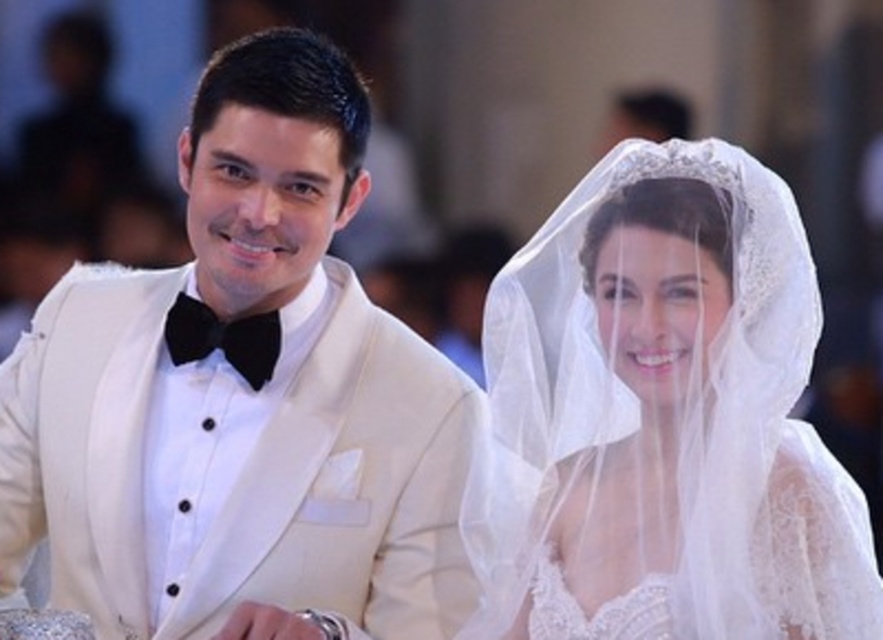
Based on the photo, can you confirm if matte white suit at left is positioned above white lace veil at upper right?

Yes.

Is matte white suit at left below white lace veil at upper right?

Incorrect, matte white suit at left is not positioned below white lace veil at upper right.

Which is in front, point (180, 403) or point (570, 595)?

Point (570, 595)

Image resolution: width=883 pixels, height=640 pixels. Identify the location of matte white suit at left. (242, 397).